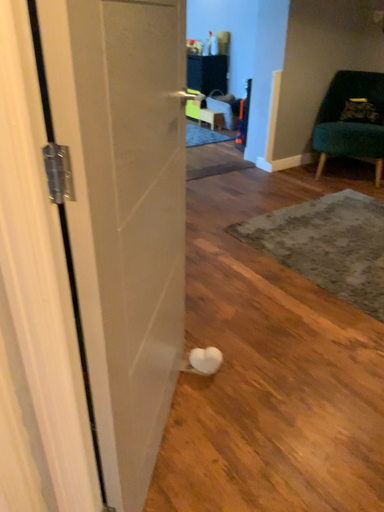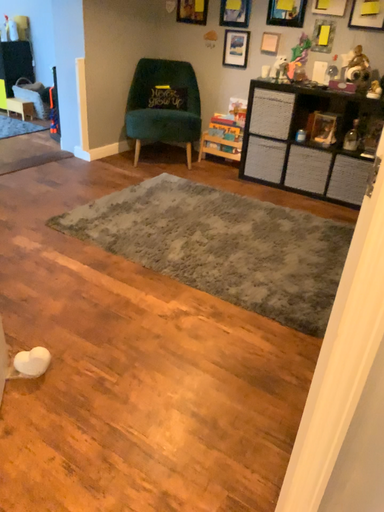
Question: Which way did the camera rotate in the video?

Choices:
 (A) rotated right
 (B) rotated left

Answer: (A)